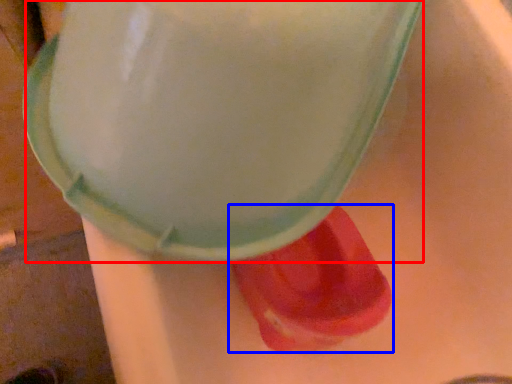
Question: Which point is further to the camera, foam (highlighted by a red box) or footwear (highlighted by a blue box)?

Choices:
 (A) foam
 (B) footwear

Answer: (B)